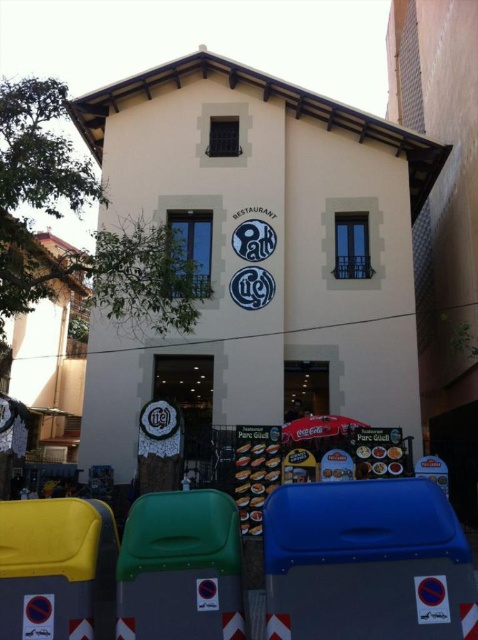
You are standing in front of the building and need to place a rectangular box that is 1.2 meters wide. Which bin, the blue plastic bin at lower right or the yellow plastic bin at lower left, can accommodate the box based on their widths?

The yellow plastic bin at lower left has a greater width than the blue plastic bin at lower right. Since the box is 1.2 meters wide, the yellow plastic bin at lower left is more likely to accommodate it if its width is sufficient, but the exact width isn

You are standing in front of the building and need to place a recycling item into the correct bin. The blue plastic bin at lower right is for recyclables. Which bin should you approach if you want to dispose of recyclables, and is it to the left or right of the yellow plastic bin at lower left?

You should approach the blue plastic bin at lower right for recyclables. It is to the right of the yellow plastic bin at lower left.